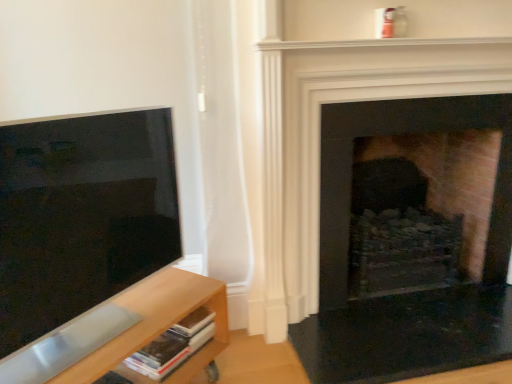
Question: In terms of size, does brick fireplace at center, placed as the 1th fireplace when sorted from front to back, appear bigger or smaller than brick fireplace at right, the 2th fireplace viewed from the front?

Choices:
 (A) big
 (B) small

Answer: (B)

Question: Choose the correct answer: Is brick fireplace at center, marked as the 2th fireplace in a back-to-front arrangement, inside brick fireplace at right, the 2th fireplace viewed from the front, or outside it?

Choices:
 (A) inside
 (B) outside

Answer: (B)

Question: Which of these objects is positioned closest to the brick fireplace at right, the 2th fireplace viewed from the front?

Choices:
 (A) brick fireplace at center, placed as the 1th fireplace when sorted from front to back
 (B) matte black screen at left
 (C) light wood shelf at lower left

Answer: (A)

Question: Considering the real-world distances, which object is closest to the brick fireplace at center, marked as the 2th fireplace in a back-to-front arrangement?

Choices:
 (A) brick fireplace at right, positioned as the 1th fireplace in back-to-front order
 (B) light wood shelf at lower left
 (C) matte black screen at left

Answer: (A)